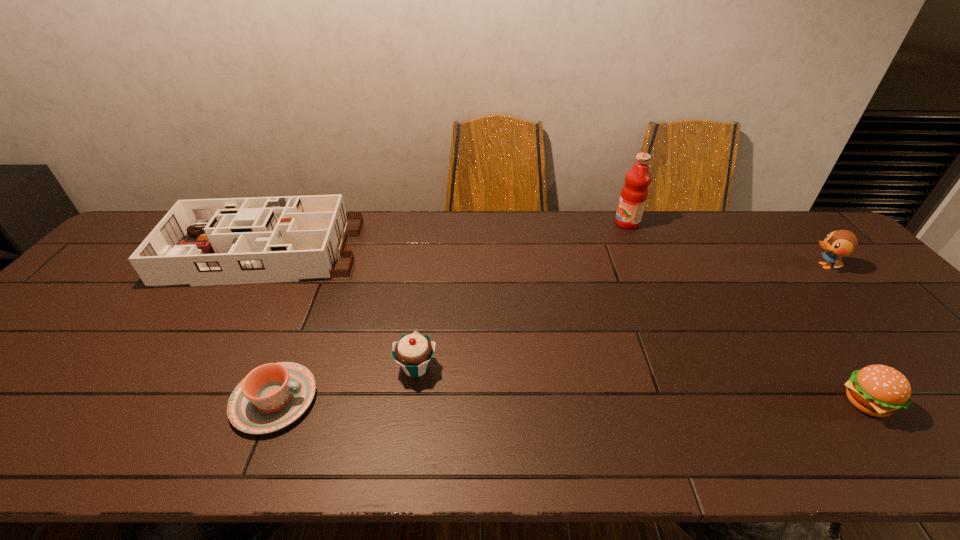
This screenshot has height=540, width=960. Find the location of `free location located 0.180m on the front-facing side of the duck`. free location located 0.180m on the front-facing side of the duck is located at coordinates (746, 266).

Locate an element on the screen. vacant position located 0.190m on the front-facing side of the duck is located at coordinates (742, 266).

The image size is (960, 540). Identify the location of vacant area situated on the front-facing side of the duck. (681, 266).

You are a GUI agent. You are given a task and a screenshot of the screen. Output one action in this format:
    pyautogui.click(x=<x>, y=<y>)
    Task: Click on the vacant area situated 0.370m on the right of the dollhouse
    The width and height of the screenshot is (960, 540).
    Given the screenshot: What is the action you would take?
    pyautogui.click(x=482, y=252)

Where is `vacant space situated on the front of the cupcake`? This screenshot has height=540, width=960. vacant space situated on the front of the cupcake is located at coordinates (408, 427).

Locate an element on the screen. The image size is (960, 540). vacant region located on the left of the hamburger is located at coordinates (815, 403).

Locate an element on the screen. This screenshot has width=960, height=540. vacant space located 0.250m on the handle side of the shortest object is located at coordinates (432, 400).

Locate an element on the screen. This screenshot has height=540, width=960. fruit juice that is at the far edge is located at coordinates (634, 193).

The height and width of the screenshot is (540, 960). In order to click on dollhouse located at the far edge in this screenshot , I will do `click(256, 240)`.

Locate an element on the screen. This screenshot has width=960, height=540. hamburger present at the near edge is located at coordinates (878, 390).